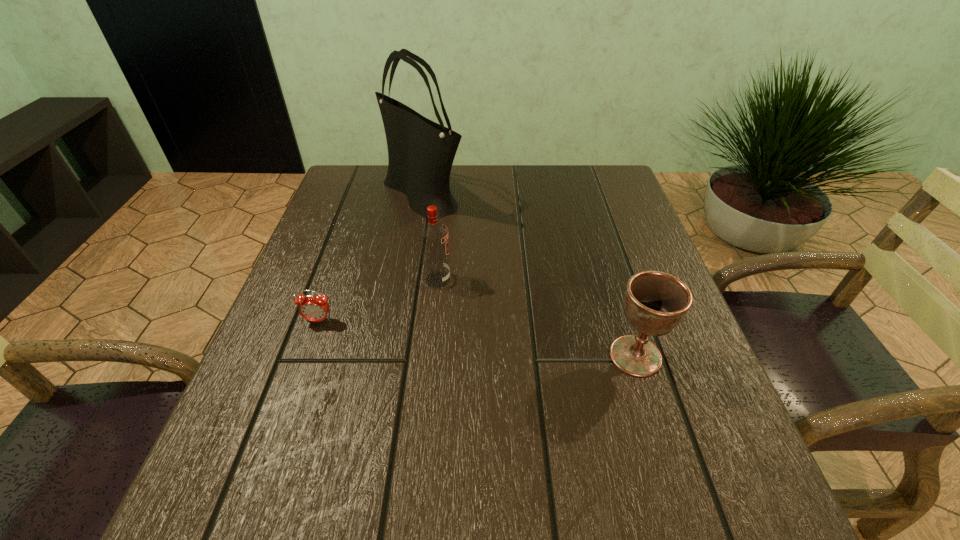
I want to click on the farthest object, so click(421, 152).

Locate an element on the screen. The height and width of the screenshot is (540, 960). the tallest object is located at coordinates (421, 152).

The width and height of the screenshot is (960, 540). Identify the location of vodka. (434, 238).

Where is `the rightmost object`? the rightmost object is located at coordinates (655, 302).

Identify the location of chalice. Image resolution: width=960 pixels, height=540 pixels. (655, 302).

The width and height of the screenshot is (960, 540). I want to click on the leftmost object, so click(313, 308).

The height and width of the screenshot is (540, 960). I want to click on the shortest object, so click(313, 308).

Identify the location of vacant space located on the front of the tallest object. (396, 353).

In order to click on vacant point located 0.190m on the front label of the third nearest object in this screenshot , I will do pos(541,280).

At what (x,y) coordinates should I click in order to perform the action: click on vacant space located on the back of the nearest object. Please return your answer as a coordinate pair (x, y). Looking at the image, I should click on (612, 279).